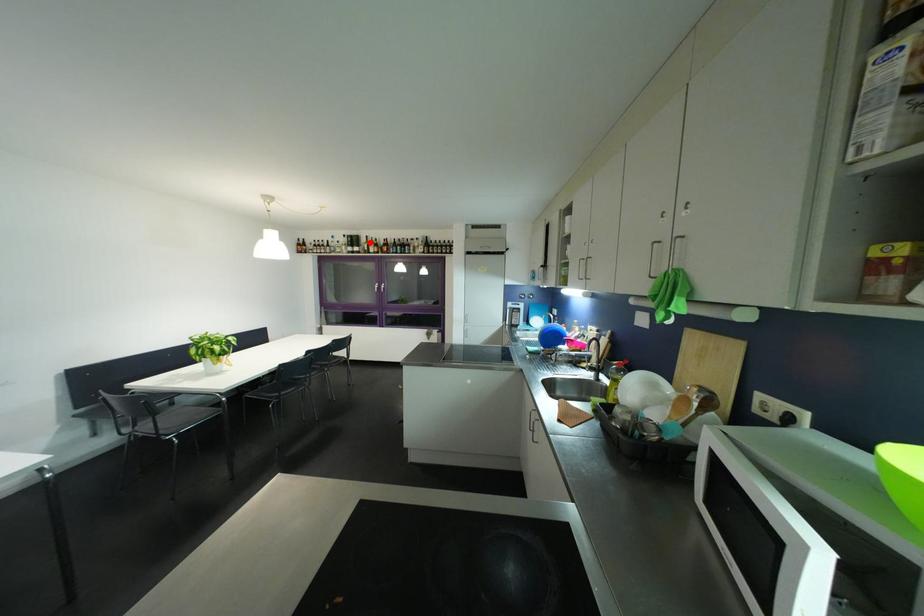
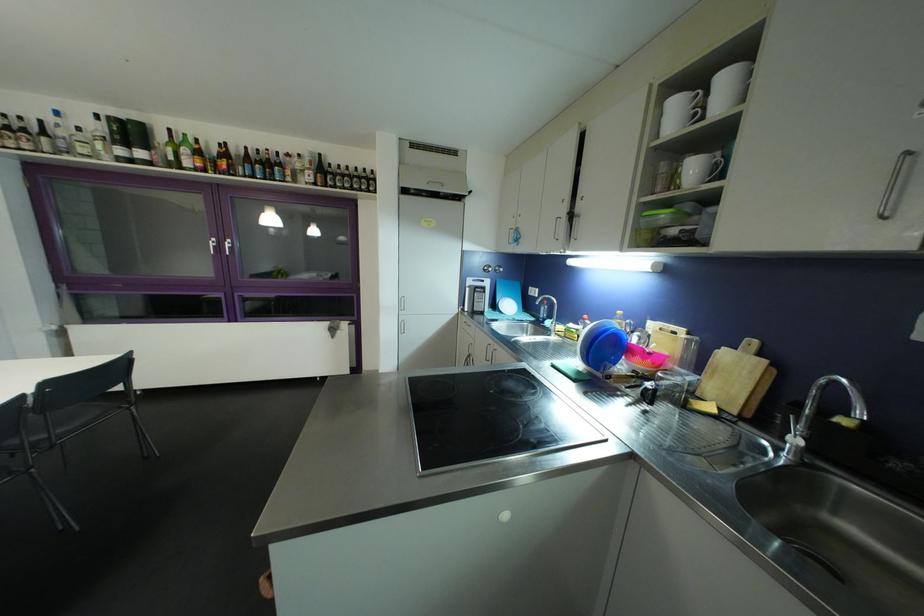
Question: I am providing you with two images of the same scene from different viewpoints. In image1, a red point is highlighted. Considering the same 3D point in image2, which of the following is correct?

Choices:
 (A) It is closer
 (B) It is farther

Answer: (B)